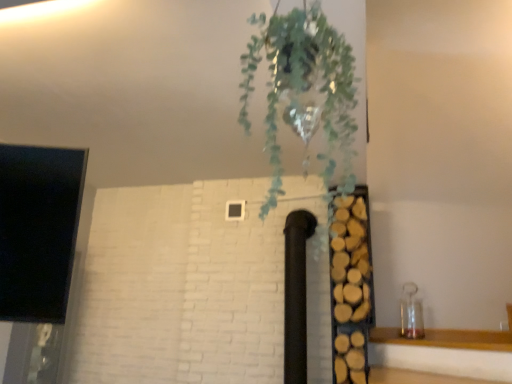
The height and width of the screenshot is (384, 512). Describe the element at coordinates (351, 286) in the screenshot. I see `wooden logs at right` at that location.

In order to face wooden logs at right, should I rotate leftwards or rightwards?

To align with it, rotate right about 12.677°.

Locate an element on the screen. This screenshot has width=512, height=384. wooden logs at right is located at coordinates (351, 286).

The width and height of the screenshot is (512, 384). Describe the element at coordinates (304, 89) in the screenshot. I see `green leafy plant at upper center` at that location.

Image resolution: width=512 pixels, height=384 pixels. Find the location of `green leafy plant at upper center`. green leafy plant at upper center is located at coordinates (304, 89).

At what (x,y) coordinates should I click in order to perform the action: click on wooden logs at right. Please return your answer as a coordinate pair (x, y). Looking at the image, I should click on (351, 286).

Based on their positions, is wooden logs at right located to the left or right of green leafy plant at upper center?

From the image, it's evident that wooden logs at right is to the right of green leafy plant at upper center.

Considering the relative positions of wooden logs at right and green leafy plant at upper center in the image provided, is wooden logs at right behind green leafy plant at upper center?

Yes, the depth of wooden logs at right is greater than that of green leafy plant at upper center.

Is point (365, 320) positioned behind point (336, 36)?

Yes.

Consider the image. From the image's perspective, would you say wooden logs at right is positioned over green leafy plant at upper center?

No.

From a real-world perspective, relative to green leafy plant at upper center, is wooden logs at right vertically above or below?

wooden logs at right is situated lower than green leafy plant at upper center in the real world.

In terms of width, does wooden logs at right look wider or thinner when compared to green leafy plant at upper center?

wooden logs at right is wider than green leafy plant at upper center.

Considering the sizes of objects wooden logs at right and green leafy plant at upper center in the image provided, who is taller, wooden logs at right or green leafy plant at upper center?

With more height is wooden logs at right.

Does wooden logs at right have a smaller size compared to green leafy plant at upper center?

No, wooden logs at right is not smaller than green leafy plant at upper center.

Is wooden logs at right surrounding green leafy plant at upper center?

Definitely not — green leafy plant at upper center is not inside wooden logs at right.

Based on the photo, is wooden logs at right in contact with green leafy plant at upper center?

No, wooden logs at right is not making contact with green leafy plant at upper center.

Is wooden logs at right positioned with its back to green leafy plant at upper center?

wooden logs at right is not turned away from green leafy plant at upper center.

What's the angular difference between wooden logs at right and green leafy plant at upper center's facing directions?

They differ by 0.00727 degrees in their facing directions.

The width and height of the screenshot is (512, 384). I want to click on shelf below the green leafy plant at upper center (from a real-world perspective), so click(351, 286).

Which object is positioned more to the right, green leafy plant at upper center or wooden logs at right?

wooden logs at right is more to the right.

Which object is closer to the camera, green leafy plant at upper center or wooden logs at right?

green leafy plant at upper center is in front.

Does point (302, 73) come farther from viewer compared to point (362, 356)?

That is False.

From the image's perspective, does green leafy plant at upper center appear higher than wooden logs at right?

Yes, from the image's perspective, green leafy plant at upper center is over wooden logs at right.

From a real-world perspective, which is physically below, green leafy plant at upper center or wooden logs at right?

wooden logs at right, from a real-world perspective.

Considering the relative sizes of green leafy plant at upper center and wooden logs at right in the image provided, is green leafy plant at upper center wider than wooden logs at right?

No, green leafy plant at upper center is not wider than wooden logs at right.

Which of these two, green leafy plant at upper center or wooden logs at right, stands shorter?

green leafy plant at upper center is shorter.

In terms of size, does green leafy plant at upper center appear bigger or smaller than wooden logs at right?

In the image, green leafy plant at upper center appears to be smaller than wooden logs at right.

Which is correct: green leafy plant at upper center is inside wooden logs at right, or outside of it?

green leafy plant at upper center is outside wooden logs at right.

Is green leafy plant at upper center in contact with wooden logs at right?

green leafy plant at upper center is not next to wooden logs at right, and they're not touching.

Is green leafy plant at upper center turned away from wooden logs at right?

Yes, green leafy plant at upper center is facing away from wooden logs at right.

How different are the orientations of green leafy plant at upper center and wooden logs at right in degrees?

The angular difference between green leafy plant at upper center and wooden logs at right is 0.00727 degrees.

Image resolution: width=512 pixels, height=384 pixels. I want to click on houseplant above the wooden logs at right (from the image's perspective), so (x=304, y=89).

You are a GUI agent. You are given a task and a screenshot of the screen. Output one action in this format:
    pyautogui.click(x=<x>, y=<y>)
    Task: Click on the shelf that is on the right side of green leafy plant at upper center
    
    Given the screenshot: What is the action you would take?
    pyautogui.click(x=351, y=286)

Identify the location of houseplant above the wooden logs at right (from a real-world perspective). point(304,89).